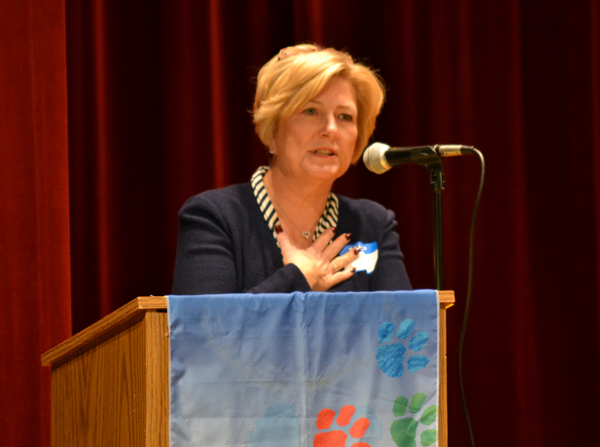
In order to click on red curtains in this screenshot , I will do `click(531, 116)`.